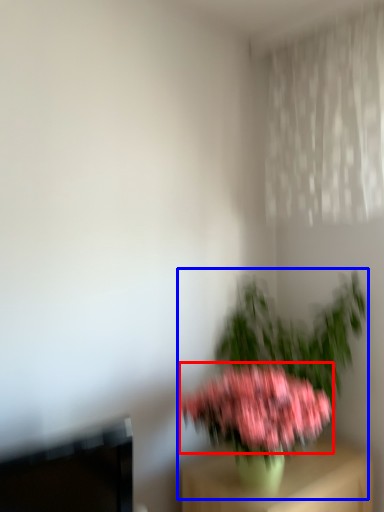
Question: Which of the following is the closest to the observer, flower (highlighted by a red box) or houseplant (highlighted by a blue box)?

Choices:
 (A) flower
 (B) houseplant

Answer: (A)